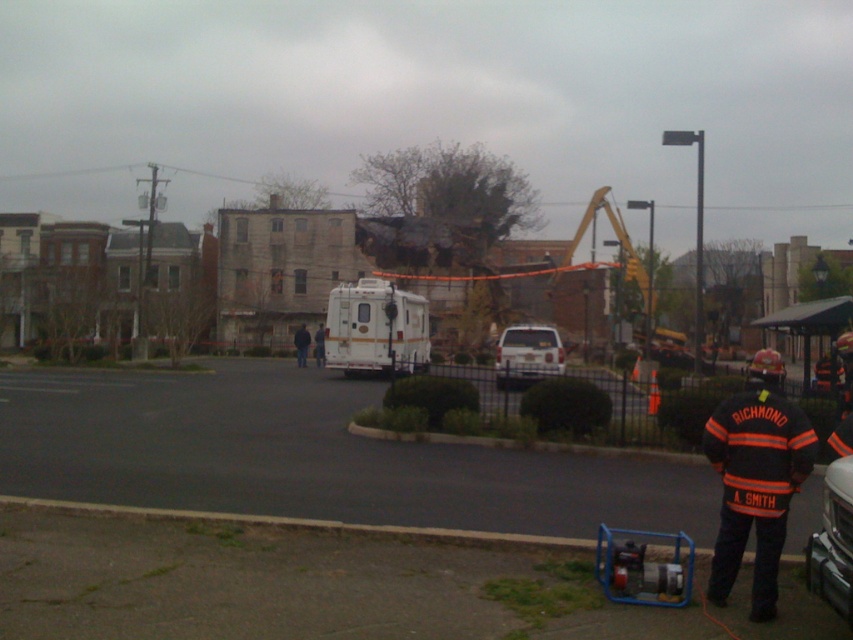
Does white matte ambulance at center appear on the left side of white matte van at center?

Indeed, white matte ambulance at center is positioned on the left side of white matte van at center.

Between white matte ambulance at center and white matte van at center, which one appears on the left side from the viewer's perspective?

Positioned to the left is white matte ambulance at center.

The height and width of the screenshot is (640, 853). In order to click on white matte ambulance at center in this screenshot , I will do `click(375, 328)`.

Is white matte van at center to the left of orange reflective jacket at center from the viewer's perspective?

Incorrect, white matte van at center is not on the left side of orange reflective jacket at center.

This screenshot has width=853, height=640. What are the coordinates of `white matte van at center` in the screenshot? It's located at (527, 355).

Is point (502, 353) more distant than point (305, 362)?

No, (502, 353) is in front of (305, 362).

Identify the location of white matte van at center. The height and width of the screenshot is (640, 853). (527, 355).

Can you confirm if orange reflective jacket at lower right is smaller than orange reflective jacket at center?

No.

This screenshot has height=640, width=853. What are the coordinates of `orange reflective jacket at lower right` in the screenshot? It's located at (756, 477).